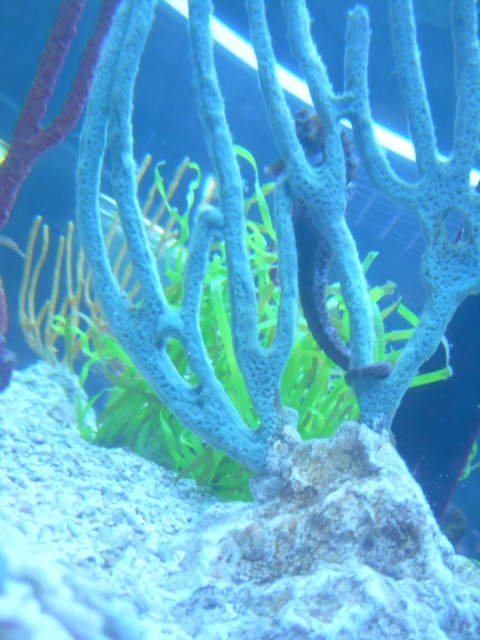
Who is more distant from viewer, [448,532] or [12,248]?

Point [12,248]

In the scene shown: Between shiny silver fish at center and translucent blue fish at upper left, which one has less height?

translucent blue fish at upper left is shorter.

This screenshot has width=480, height=640. Describe the element at coordinates (453, 524) in the screenshot. I see `shiny silver fish at center` at that location.

Locate an element on the screen. shiny silver fish at center is located at coordinates (453, 524).